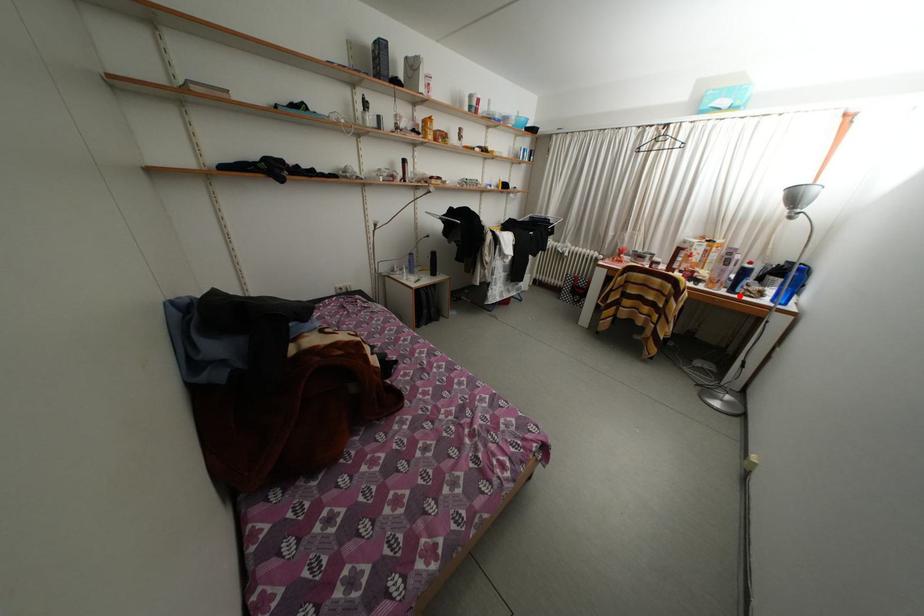
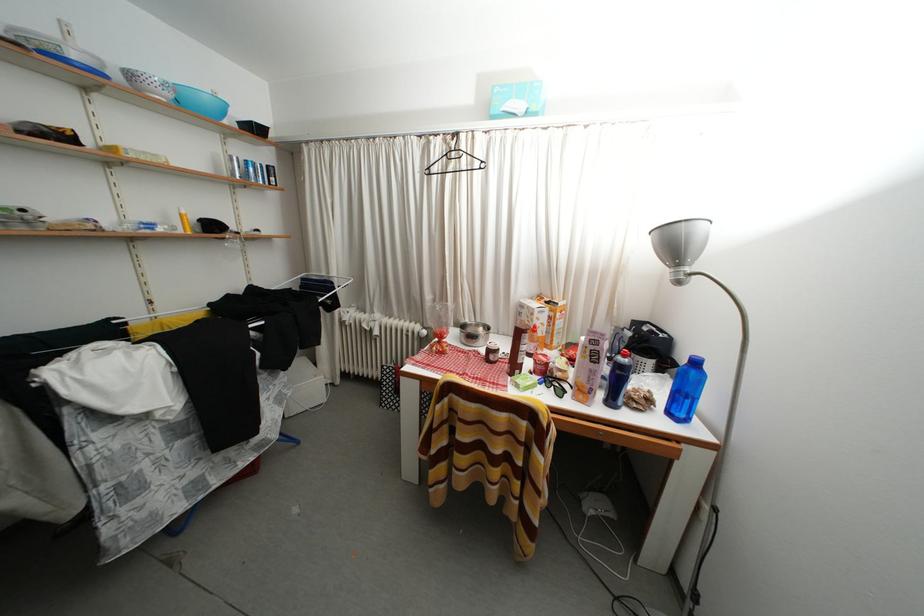
Question: I am providing you with two images of the same scene from different viewpoints. Image1 has a red point marked. In image2, the corresponding 3D location appears at what relative position? Reply with the corresponding letter.

Choices:
 (A) Closer
 (B) Farther

Answer: (B)